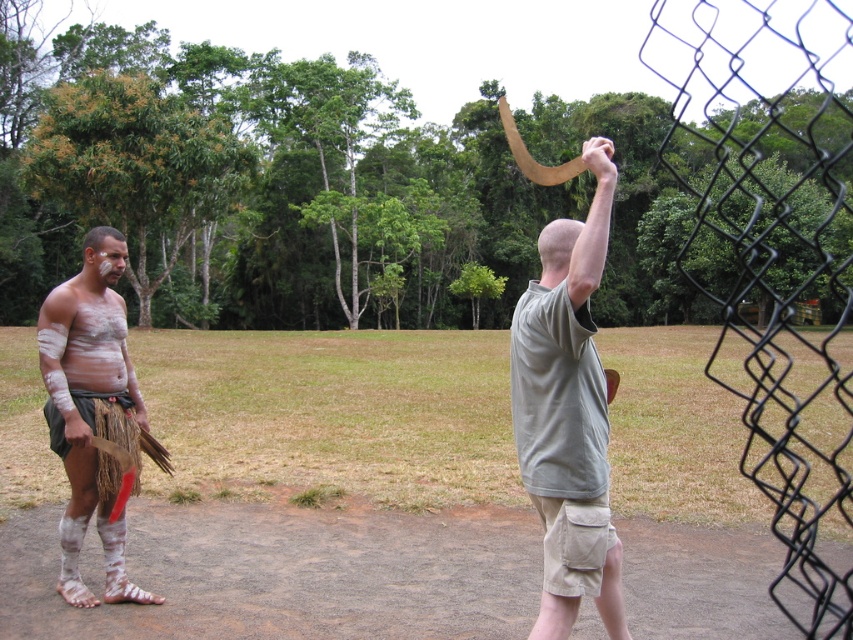
Does matte brown horn at upper right lie in front of matte white skin at left?

That is True.

Who is higher up, matte brown horn at upper right or matte white skin at left?

matte white skin at left is above.

Does point (582, 500) lie behind point (113, 301)?

That is False.

The width and height of the screenshot is (853, 640). Identify the location of matte brown horn at upper right. (567, 413).

Who is more distant from viewer, (717,257) or (97,310)?

Point (717,257)

Where is `black wire mesh fence at right`? The width and height of the screenshot is (853, 640). black wire mesh fence at right is located at coordinates (775, 257).

Who is lower down, black wire mesh fence at right or matte brown horn at upper right?

matte brown horn at upper right is lower down.

Is black wire mesh fence at right wider than matte brown horn at upper right?

Yes, black wire mesh fence at right is wider than matte brown horn at upper right.

This screenshot has width=853, height=640. What do you see at coordinates (775, 257) in the screenshot?
I see `black wire mesh fence at right` at bounding box center [775, 257].

Where is `black wire mesh fence at right`? The height and width of the screenshot is (640, 853). black wire mesh fence at right is located at coordinates (775, 257).